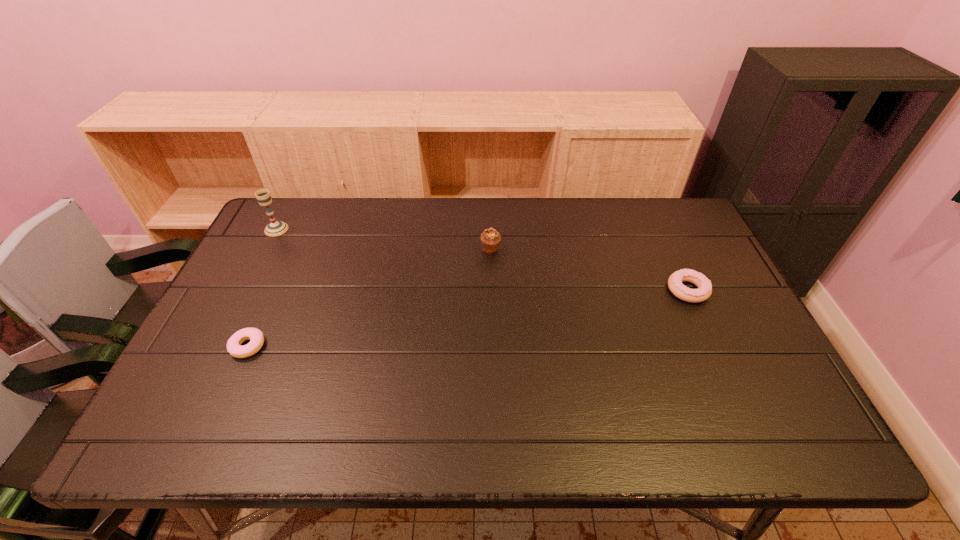
Find the location of `vacant area situated 0.300m on the back of the second nearest object`. vacant area situated 0.300m on the back of the second nearest object is located at coordinates (653, 213).

Image resolution: width=960 pixels, height=540 pixels. Find the location of `blank space located on the right of the shortest object`. blank space located on the right of the shortest object is located at coordinates (376, 346).

Where is `chalice that is at the far edge`? This screenshot has height=540, width=960. chalice that is at the far edge is located at coordinates (275, 228).

Identify the location of muffin that is at the far edge. The image size is (960, 540). (490, 238).

I want to click on chalice situated at the left edge, so click(x=275, y=228).

You are a GUI agent. You are given a task and a screenshot of the screen. Output one action in this format:
    pyautogui.click(x=<x>, y=<y>)
    Task: Click on the doughnut located in the left edge section of the desktop
    
    Given the screenshot: What is the action you would take?
    pyautogui.click(x=256, y=337)

Where is `object that is at the right edge`? The image size is (960, 540). object that is at the right edge is located at coordinates (704, 291).

At what (x,y) coordinates should I click in order to perform the action: click on object that is at the far left corner. Please return your answer as a coordinate pair (x, y). The image size is (960, 540). Looking at the image, I should click on (275, 228).

In the image, there is a desktop. Where is `vacant region at the far edge`? The image size is (960, 540). vacant region at the far edge is located at coordinates (453, 200).

At what (x,y) coordinates should I click in order to perform the action: click on free space at the near edge of the desktop. Please return your answer as a coordinate pair (x, y). The width and height of the screenshot is (960, 540). Looking at the image, I should click on (540, 438).